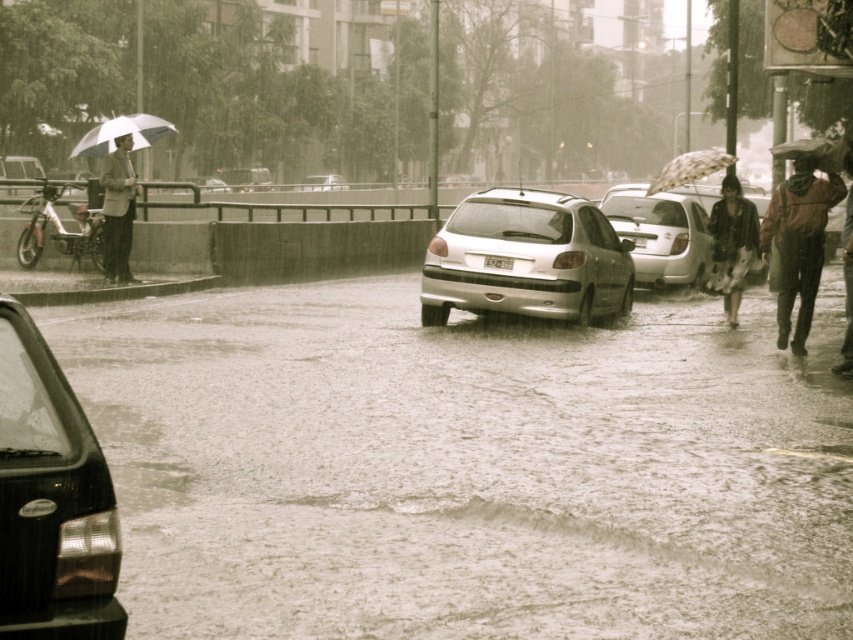
Is frothy water at center to the right of metallic silver motorbike at left from the viewer's perspective?

Indeed, frothy water at center is positioned on the right side of metallic silver motorbike at left.

Describe the element at coordinates (466, 467) in the screenshot. I see `frothy water at center` at that location.

Describe the element at coordinates (466, 467) in the screenshot. I see `frothy water at center` at that location.

I want to click on frothy water at center, so click(466, 467).

Between point (415, 616) and point (793, 141), which one is positioned in front?

Point (415, 616) is more forward.

What do you see at coordinates (466, 467) in the screenshot? The image size is (853, 640). I see `frothy water at center` at bounding box center [466, 467].

Is point (138, 364) closer to camera compared to point (784, 150)?

Yes, it is in front of point (784, 150).

The image size is (853, 640). I want to click on frothy water at center, so click(x=466, y=467).

Is point (827, 205) positioned before point (688, 173)?

That is True.

Between brown plaid pants at lower right and transparent fabric umbrella at upper right, which one has more height?

With more height is transparent fabric umbrella at upper right.

Identify the location of brown plaid pants at lower right. (798, 243).

This screenshot has width=853, height=640. Find the location of `brown plaid pants at lower right`. brown plaid pants at lower right is located at coordinates (798, 243).